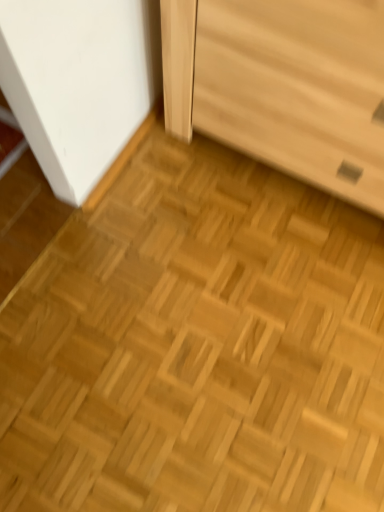
What are the coordinates of `light wood/texture chest of drawers at upper right` in the screenshot? It's located at click(x=283, y=85).

Describe the element at coordinates (283, 85) in the screenshot. I see `light wood/texture chest of drawers at upper right` at that location.

The image size is (384, 512). Identify the location of light wood/texture chest of drawers at upper right. (283, 85).